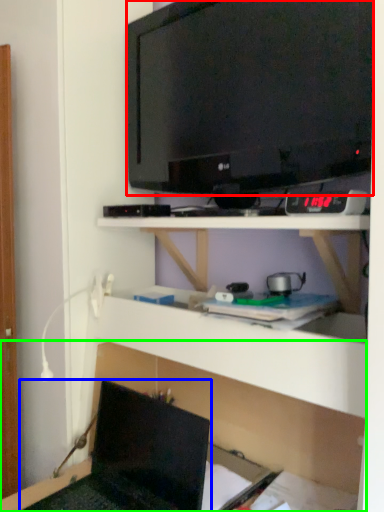
Question: Estimate the real-world distances between objects in this image. Which object is closer to television (highlighted by a red box), laptop (highlighted by a blue box) or shelf (highlighted by a green box)?

Choices:
 (A) laptop
 (B) shelf

Answer: (B)